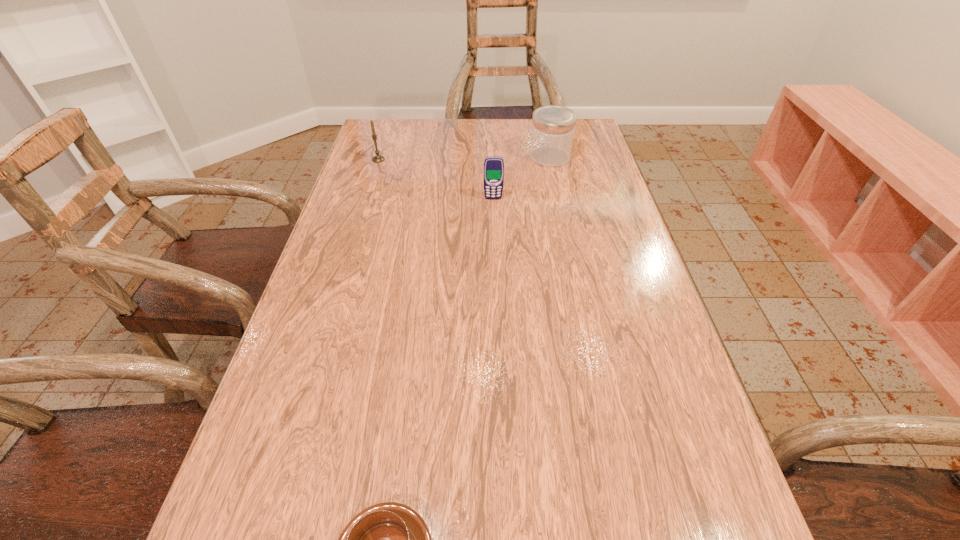
You are a GUI agent. You are given a task and a screenshot of the screen. Output one action in this format:
    pyautogui.click(x=<x>, y=<y>)
    Task: Click on the object that is positioned at the far right corner
    
    Given the screenshot: What is the action you would take?
    pyautogui.click(x=553, y=127)

Where is `vacant point at the far edge`? The height and width of the screenshot is (540, 960). vacant point at the far edge is located at coordinates (491, 152).

Identify the location of vacant space at the left edge. Image resolution: width=960 pixels, height=540 pixels. (302, 516).

Locate an element on the screen. The height and width of the screenshot is (540, 960). vacant space at the right edge of the desktop is located at coordinates (593, 252).

Find the location of a particular element. The height and width of the screenshot is (540, 960). free spot between the leftmost object and the jar is located at coordinates point(464,158).

Identify the location of free spot between the leftmost object and the third farthest object. This screenshot has height=540, width=960. (436, 179).

Identify the location of free space that is in between the third object from left to right and the candle. Image resolution: width=960 pixels, height=540 pixels. (436, 179).

The width and height of the screenshot is (960, 540). Identify the location of free space between the second object from right to left and the rightmost object. (521, 178).

Locate an element on the screen. This screenshot has width=960, height=540. vacant area between the rightmost object and the third object from left to right is located at coordinates (521, 178).

Find the location of a particular element. Image resolution: width=960 pixels, height=540 pixels. vacant space that's between the second nearest object and the candle is located at coordinates point(436,179).